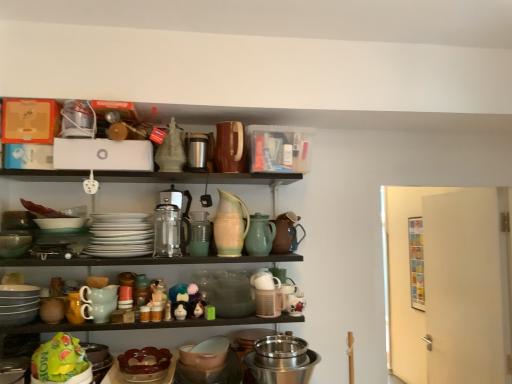
Question: From the image's perspective, is brown glossy cake stand at lower center, which is the fourth tableware from right to left, located above or below white glossy plates at center, arranged as the third tableware when viewed from the left?

Choices:
 (A) below
 (B) above

Answer: (A)

Question: From a real-world perspective, is brown glossy cake stand at lower center, which appears as the fourth tableware when viewed from the left, above or below white glossy plates at center, the fifth tableware in the right-to-left sequence?

Choices:
 (A) below
 (B) above

Answer: (A)

Question: Which object is positioned farthest from the white glossy plates at center, the fifth tableware in the right-to-left sequence?

Choices:
 (A) matte gray bowls at lower left, acting as the 7th tableware starting from the right
 (B) matte white figurine at center, which is the second toy from right to left
 (C) speckled ceramic pitcher at center, the fifth tableware in the left-to-right sequence
 (D) clear glass coffee maker at center
 (E) stainless steel bowl at lower center, the 3th appliance viewed from the top

Answer: (E)

Question: Which is nearer to the matte white figurine at center, arranged as the second toy when viewed from the left?

Choices:
 (A) brown matte pitcher at upper center, the 2th appliance positioned from the left
 (B) brown glossy cake stand at lower center, which appears as the fourth tableware when viewed from the left
 (C) stainless steel bowl at lower center, which ranks as the 1th appliance in bottom-to-top order
 (D) white matte teapot at center, the 7th tableware in the left-to-right sequence
 (E) matte plastic toy at center, acting as the 1th toy starting from the left

Answer: (E)